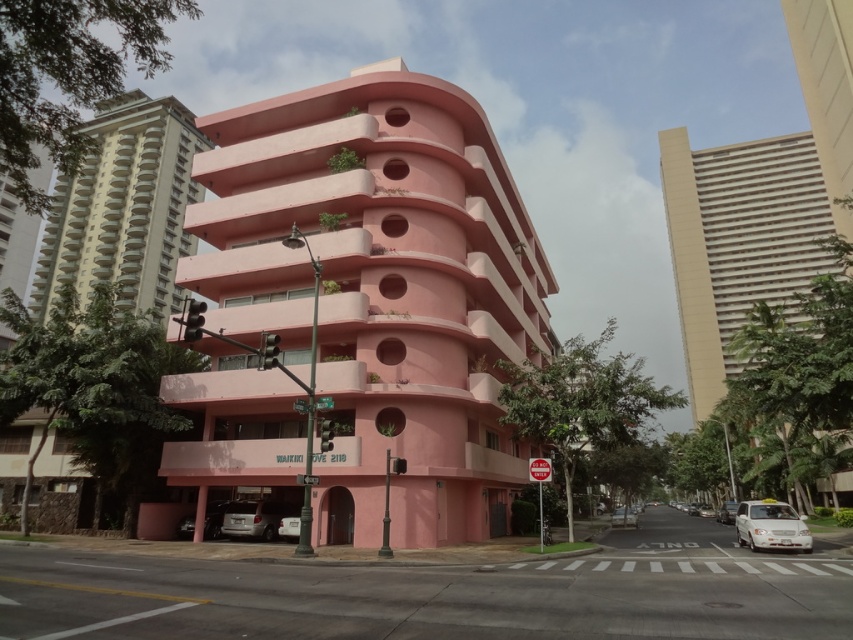
You are a city planner analyzing the layout of this urban area. Given the pink matte building at center is positioned at coordinates approximately 0.452 on the x and 0.449 on the y axis, how does its central placement affect the overall visual balance of the scene?

The pink matte building at center is located at point (381, 289), which places it centrally in the scene. This central placement contributes to a symmetrical and balanced composition, drawing the viewer s attention to the building s unique architectural design and contrasting color against the surrounding neutral tones.

You are a city planner evaluating the skyline. Based on the image, which of the two buildings, the pink matte building at center or the beige concrete tower at upper left, would cast a shorter shadow during midday? Explain your reasoning using their positions and heights.

The pink matte building at center has a lesser height compared to the beige concrete tower at upper left. Since shorter buildings cast shorter shadows, the pink matte building at center would cast a shorter shadow during midday.

You are a city planner assessing the urban space in front of the pink matte building at center and the silver metallic car at lower left. Given the size difference between them, what potential issue might arise from placing a new billboard between them?

The pink matte building at center is larger than the silver metallic car at lower left. Placing a billboard between them might block the view of the pink matte building at center from the street, as it is larger and could dominate the space, making the billboard less visible or overshadowed by the building.